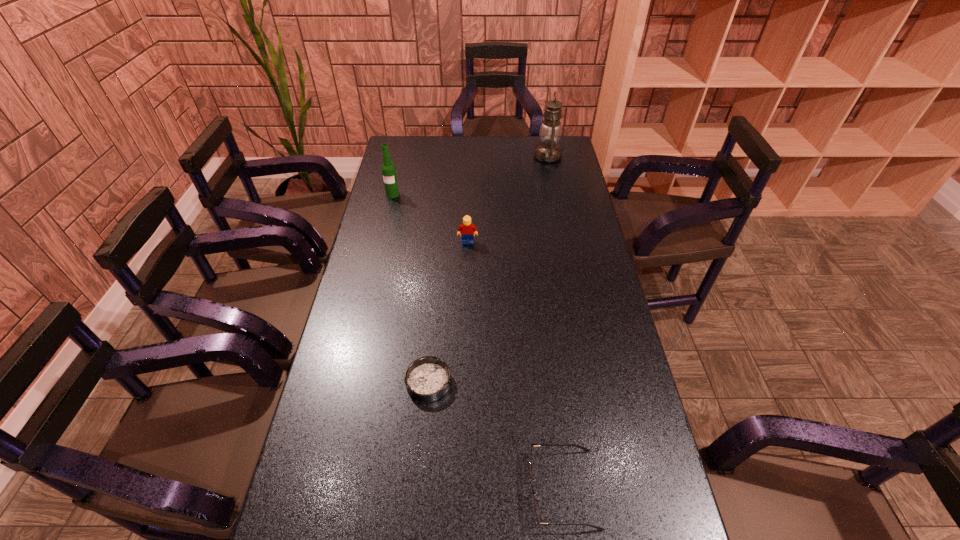
The height and width of the screenshot is (540, 960). Identify the location of the farthest object. (548, 150).

Where is `oil lamp`? The width and height of the screenshot is (960, 540). oil lamp is located at coordinates (548, 150).

Where is `beer bottle`? Image resolution: width=960 pixels, height=540 pixels. beer bottle is located at coordinates (388, 169).

The width and height of the screenshot is (960, 540). I want to click on the fourth nearest object, so click(388, 169).

In order to click on the third shortest object in this screenshot , I will do point(467,229).

I want to click on the third farthest object, so click(467, 229).

What are the coordinates of `the nearest object` in the screenshot? It's located at (583, 448).

Locate an element on the screen. This screenshot has width=960, height=540. spectacles is located at coordinates (583, 448).

What are the coordinates of `ashtray` in the screenshot? It's located at (427, 379).

At what (x,y) coordinates should I click in order to perform the action: click on the shortest object. Please return your answer as a coordinate pair (x, y). The width and height of the screenshot is (960, 540). Looking at the image, I should click on (427, 379).